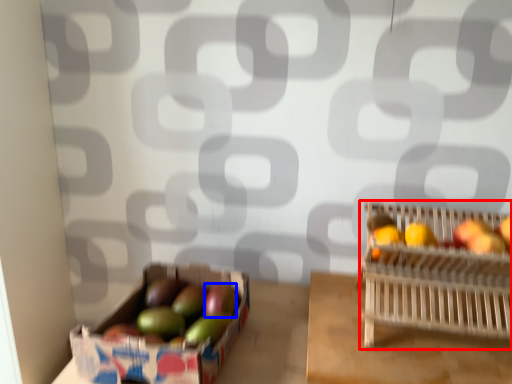
Question: Which of the following is the closest to the observer, basket (highlighted by a red box) or apple (highlighted by a blue box)?

Choices:
 (A) basket
 (B) apple

Answer: (A)